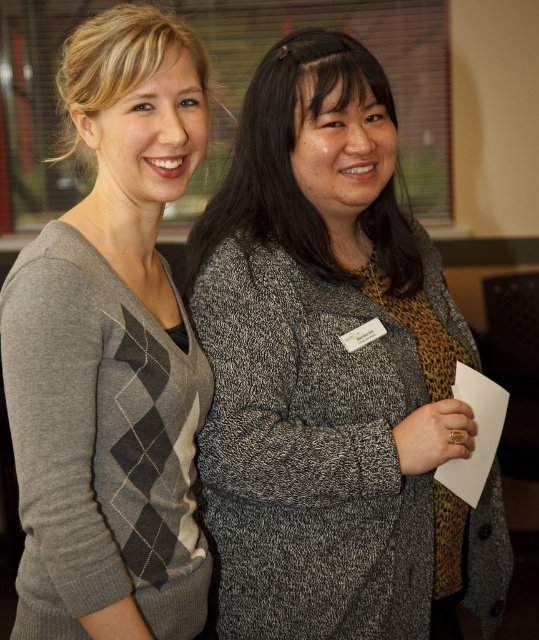
Which is more to the left, speckled gray sweater at center or gray argyle sweater at left?

Positioned to the left is gray argyle sweater at left.

In order to click on speckled gray sweater at center in this screenshot , I will do `click(333, 372)`.